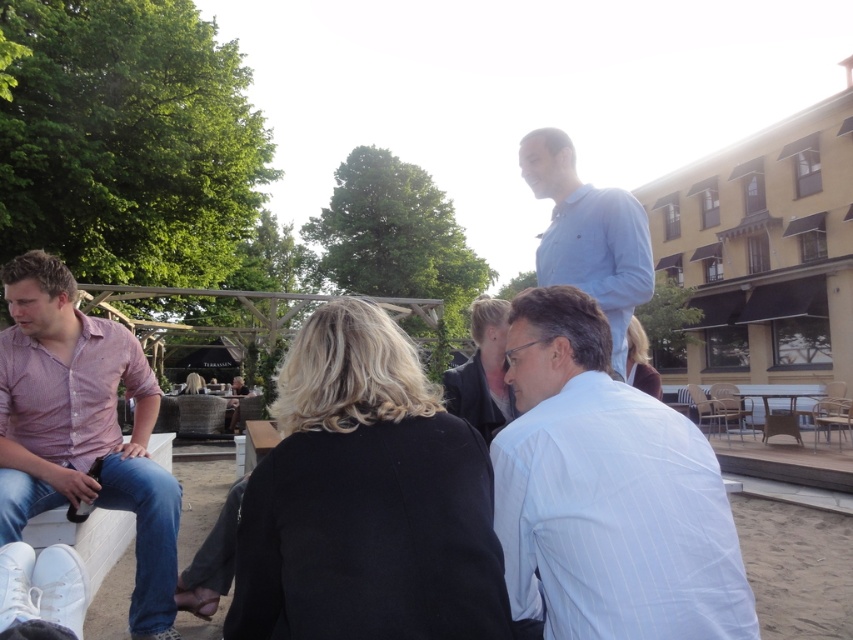
Question: Which of the following is the closest to the observer?

Choices:
 (A) pink striped shirt at left
 (B) rattan picnic table at lower right
 (C) light blue shirt at upper center
 (D) black leather jacket at center

Answer: (C)

Question: Based on their relative distances, which object is farther from the light blue shirt at upper center?

Choices:
 (A) black leather jacket at center
 (B) pink striped shirt at left
 (C) rattan picnic table at lower right

Answer: (C)

Question: Can you confirm if white striped shirt at center is positioned below rattan picnic table at lower right?

Choices:
 (A) no
 (B) yes

Answer: (A)

Question: Estimate the real-world distances between objects in this image. Which object is farther from the pink striped shirt at left?

Choices:
 (A) black leather jacket at center
 (B) light blue shirt at upper center

Answer: (B)

Question: Does white striped shirt at center appear on the left side of light blue shirt at upper center?

Choices:
 (A) no
 (B) yes

Answer: (B)

Question: Is white striped shirt at center to the right of pink striped shirt at left from the viewer's perspective?

Choices:
 (A) no
 (B) yes

Answer: (B)